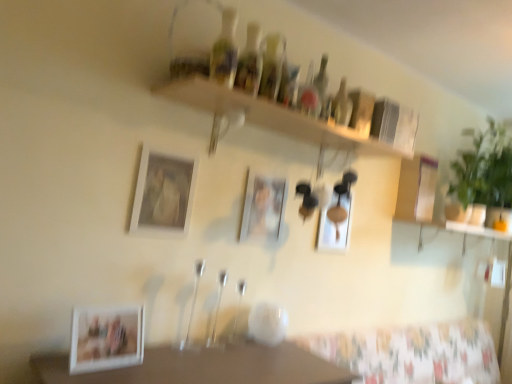
What do you see at coordinates (106, 338) in the screenshot? The width and height of the screenshot is (512, 384). I see `white matte picture frame at lower left, acting as the 4th picture frame starting from the back` at bounding box center [106, 338].

What is the approximate width of matte white picture frame at center, which is counted as the first picture frame, starting from the back?

matte white picture frame at center, which is counted as the first picture frame, starting from the back, is 3.03 centimeters in width.

Describe the element at coordinates (335, 223) in the screenshot. This screenshot has height=384, width=512. I see `matte white picture frame at center, which is counted as the first picture frame, starting from the back` at that location.

I want to click on green leafy plant at right, so click(x=484, y=168).

From a real-world perspective, is matte white picture frame at center, which appears as the 4th picture frame when viewed from the front, positioned above or below translucent glass bottles at upper center, marked as the fourth bottle in a right-to-left arrangement?

In terms of real-world spatial position, matte white picture frame at center, which appears as the 4th picture frame when viewed from the front, is below translucent glass bottles at upper center, marked as the fourth bottle in a right-to-left arrangement.

Is the position of matte white picture frame at center, which appears as the 4th picture frame when viewed from the front, less distant than that of translucent glass bottles at upper center, acting as the fourth bottle starting from the back?

No, it is not.

Considering the sizes of objects matte white picture frame at center, the fourth picture frame viewed from the left, and translucent glass bottles at upper center, marked as the second bottle in a left-to-right arrangement, in the image provided, who is smaller, matte white picture frame at center, the fourth picture frame viewed from the left, or translucent glass bottles at upper center, marked as the second bottle in a left-to-right arrangement,?

translucent glass bottles at upper center, marked as the second bottle in a left-to-right arrangement, is smaller.

Identify the location of the 4th bottle in front of the matte white picture frame at center, which is counted as the first picture frame, starting from the back. (250, 63).

In terms of width, does translucent glass bottles at upper center, arranged as the 1th bottle when viewed from the front, look wider or thinner when compared to matte white picture frame at center, the fourth picture frame viewed from the left?

In the image, translucent glass bottles at upper center, arranged as the 1th bottle when viewed from the front, appears to be wider than matte white picture frame at center, the fourth picture frame viewed from the left.

From the matte white picture frame at center, the first picture frame from the right, count 5th bottles forward and point to it. Please provide its 2D coordinates.

[(225, 51)]

From a real-world perspective, is translucent glass bottles at upper center, which is counted as the fifth bottle, starting from the back, on top of matte white picture frame at center, which appears as the 4th picture frame when viewed from the front?

Yes, from a real-world perspective, translucent glass bottles at upper center, which is counted as the fifth bottle, starting from the back, is on top of matte white picture frame at center, which appears as the 4th picture frame when viewed from the front.

Would you say white matte picture frame at lower left, acting as the 4th picture frame starting from the back, is inside or outside translucent glass bottle at upper center, marked as the 5th bottle in a left-to-right arrangement?

white matte picture frame at lower left, acting as the 4th picture frame starting from the back, is outside translucent glass bottle at upper center, marked as the 5th bottle in a left-to-right arrangement.

Is white matte picture frame at lower left, which appears as the 4th picture frame when viewed from the right, at the right side of translucent glass bottle at upper center, the first bottle from the right?

No.

From a real-world perspective, which bottle is the 1st one above the white matte picture frame at lower left, which is the first picture frame from left to right? Please provide its 2D coordinates.

[(342, 105)]

From a real-world perspective, is white matte picture frame at lower left, acting as the 4th picture frame starting from the back, located beneath translucent glass bottle at upper center, the 5th bottle viewed from the front?

Yes, from a real-world perspective, white matte picture frame at lower left, acting as the 4th picture frame starting from the back, is below translucent glass bottle at upper center, the 5th bottle viewed from the front.

Which is more to the left, matte white picture frame at upper center, the third picture frame positioned from the back, or translucent glass bottle at upper center, positioned as the fourth bottle in front-to-back order?

matte white picture frame at upper center, the third picture frame positioned from the back, is more to the left.

Can you tell me how much matte white picture frame at upper center, marked as the third picture frame in a right-to-left arrangement, and translucent glass bottle at upper center, which appears as the 4th bottle when viewed from the left, differ in facing direction?

matte white picture frame at upper center, marked as the third picture frame in a right-to-left arrangement, and translucent glass bottle at upper center, which appears as the 4th bottle when viewed from the left, are facing 1.01 degrees away from each other.

Looking at this image, is there a large distance between matte white picture frame at upper center, marked as the third picture frame in a right-to-left arrangement, and translucent glass bottle at upper center, the 2th bottle from the back?

That's not correct — matte white picture frame at upper center, marked as the third picture frame in a right-to-left arrangement, is a little close to translucent glass bottle at upper center, the 2th bottle from the back.

From a real-world perspective, which picture frame is the 1st one underneath the translucent glass bottle at upper center, which appears as the 4th bottle when viewed from the left? Please provide its 2D coordinates.

[(163, 193)]

Considering the positions of objects matte silver picture frame at center, the 2th picture frame viewed from the back, and translucent glass bottles at upper center, which is the third bottle from back to front, in the image provided, who is in front, matte silver picture frame at center, the 2th picture frame viewed from the back, or translucent glass bottles at upper center, which is the third bottle from back to front,?

translucent glass bottles at upper center, which is the third bottle from back to front.

Is matte silver picture frame at center, which is the 2th picture frame in right-to-left order, located outside translucent glass bottles at upper center, which is the third bottle from front to back?

That's correct, matte silver picture frame at center, which is the 2th picture frame in right-to-left order, is outside of translucent glass bottles at upper center, which is the third bottle from front to back.

How different are the orientations of matte silver picture frame at center, placed as the 3th picture frame when sorted from left to right, and translucent glass bottles at upper center, which is the third bottle from back to front, in degrees?

0.0385 degrees separate the facing orientations of matte silver picture frame at center, placed as the 3th picture frame when sorted from left to right, and translucent glass bottles at upper center, which is the third bottle from back to front.

Looking at their sizes, would you say matte silver picture frame at center, placed as the 3th picture frame when sorted from left to right, is wider or thinner than translucent glass bottles at upper center, which is the third bottle from front to back?

Considering their sizes, matte silver picture frame at center, placed as the 3th picture frame when sorted from left to right, looks slimmer than translucent glass bottles at upper center, which is the third bottle from front to back.

Is green leafy plant at right surrounded by translucent glass bottle at upper center, the 5th bottle viewed from the front?

No.

Can you tell me how much translucent glass bottle at upper center, the 5th bottle viewed from the front, and green leafy plant at right differ in facing direction?

The angle between the facing direction of translucent glass bottle at upper center, the 5th bottle viewed from the front, and the facing direction of green leafy plant at right is 3.85 degrees.

Is translucent glass bottle at upper center, the 5th bottle viewed from the front, looking in the opposite direction of green leafy plant at right?

No, green leafy plant at right is not at the back of translucent glass bottle at upper center, the 5th bottle viewed from the front.

Measure the distance from white matte picture frame at lower left, which is the first picture frame from left to right, to translucent glass bottles at upper center, which is counted as the fifth bottle, starting from the back.

white matte picture frame at lower left, which is the first picture frame from left to right, is 37.32 inches from translucent glass bottles at upper center, which is counted as the fifth bottle, starting from the back.

Between white matte picture frame at lower left, which appears as the 4th picture frame when viewed from the right, and translucent glass bottles at upper center, which is the fifth bottle in right-to-left order, which one has smaller width?

translucent glass bottles at upper center, which is the fifth bottle in right-to-left order.

Is white matte picture frame at lower left, which appears as the 4th picture frame when viewed from the right, taller or shorter than translucent glass bottles at upper center, the 1th bottle in the left-to-right sequence?

Considering their sizes, white matte picture frame at lower left, which appears as the 4th picture frame when viewed from the right, has less height than translucent glass bottles at upper center, the 1th bottle in the left-to-right sequence.

From the image's perspective, is white matte picture frame at lower left, acting as the 4th picture frame starting from the back, above or below translucent glass bottles at upper center, arranged as the 1th bottle when viewed from the front?

From the image's perspective, white matte picture frame at lower left, acting as the 4th picture frame starting from the back, appears below translucent glass bottles at upper center, arranged as the 1th bottle when viewed from the front.

From the image's perspective, which bottle is the 4th one above the matte white picture frame at center, the first picture frame from the right? Please provide its 2D coordinates.

[(250, 63)]

You are a GUI agent. You are given a task and a screenshot of the screen. Output one action in this format:
    pyautogui.click(x=<x>, y=<y>)
    Task: Click on the 5th bottle in front of the matte white picture frame at center, which is counted as the first picture frame, starting from the back, counting from the anchor's position
    The height and width of the screenshot is (384, 512).
    Given the screenshot: What is the action you would take?
    tap(225, 51)

Looking at the image, which one is located closer to translucent glass bottles at upper center, the 1th bottle in the left-to-right sequence, matte silver picture frame at center, which is the 2th picture frame in right-to-left order, or green leafy plant at right?

Based on the image, matte silver picture frame at center, which is the 2th picture frame in right-to-left order, appears to be nearer to translucent glass bottles at upper center, the 1th bottle in the left-to-right sequence.

Estimate the real-world distances between objects in this image. Which object is further from matte white picture frame at upper center, the third picture frame positioned from the back, translucent glass bottle at upper center, the 2th bottle from the back, or translucent glass bottles at upper center, marked as the fourth bottle in a right-to-left arrangement?

Based on the image, translucent glass bottle at upper center, the 2th bottle from the back, appears to be further to matte white picture frame at upper center, the third picture frame positioned from the back.

Consider the image. From the image, which object appears to be nearer to translucent glass bottle at upper center, marked as the 5th bottle in a left-to-right arrangement, green leafy plant at right or translucent glass bottles at upper center, acting as the fourth bottle starting from the back?

translucent glass bottles at upper center, acting as the fourth bottle starting from the back, lies closer to translucent glass bottle at upper center, marked as the 5th bottle in a left-to-right arrangement, than the other object.

Looking at the image, which one is located further to matte white picture frame at upper center, the third picture frame positioned from the back, translucent glass bottle at upper center, the 5th bottle viewed from the front, or translucent glass bottles at upper center, which is counted as the fifth bottle, starting from the back?

translucent glass bottle at upper center, the 5th bottle viewed from the front, is positioned further to the anchor matte white picture frame at upper center, the third picture frame positioned from the back.

From the image, which object appears to be nearer to translucent glass bottles at upper center, which is the fifth bottle in right-to-left order, translucent glass bottles at upper center, which is the 3th bottle from right to left, or matte white picture frame at center, which appears as the 4th picture frame when viewed from the front?

translucent glass bottles at upper center, which is the 3th bottle from right to left, is closer to translucent glass bottles at upper center, which is the fifth bottle in right-to-left order.

Based on the photo, estimate the real-world distances between objects in this image. Which object is closer to translucent glass bottle at upper center, the first bottle from the right, translucent glass bottles at upper center, which is the third bottle from left to right, or translucent glass bottles at upper center, the 1th bottle in the left-to-right sequence?

Based on the image, translucent glass bottles at upper center, which is the third bottle from left to right, appears to be nearer to translucent glass bottle at upper center, the first bottle from the right.

Based on their spatial positions, is translucent glass bottle at upper center, the 5th bottle viewed from the front, or matte white picture frame at center, which appears as the 4th picture frame when viewed from the front, further from translucent glass bottles at upper center, arranged as the 1th bottle when viewed from the front?

Among the two, matte white picture frame at center, which appears as the 4th picture frame when viewed from the front, is located further to translucent glass bottles at upper center, arranged as the 1th bottle when viewed from the front.

Considering their positions, is translucent glass bottles at upper center, which is the 3th bottle from right to left, positioned closer to matte silver picture frame at center, the 2th picture frame viewed from the back, than matte white picture frame at center, which is counted as the first picture frame, starting from the back?

Based on the image, matte white picture frame at center, which is counted as the first picture frame, starting from the back, appears to be nearer to matte silver picture frame at center, the 2th picture frame viewed from the back.

Locate an element on the screen. The height and width of the screenshot is (384, 512). bottle between translucent glass bottle at upper center, positioned as the fourth bottle in front-to-back order, and matte silver picture frame at center, which is the 2th picture frame in right-to-left order, from top to bottom is located at coordinates (342, 105).

Where is `bottle situated between translucent glass bottles at upper center, which is the 3th bottle from right to left, and translucent glass bottle at upper center, marked as the 5th bottle in a left-to-right arrangement, from left to right`? The height and width of the screenshot is (384, 512). bottle situated between translucent glass bottles at upper center, which is the 3th bottle from right to left, and translucent glass bottle at upper center, marked as the 5th bottle in a left-to-right arrangement, from left to right is located at coordinates (321, 85).

The image size is (512, 384). Find the location of `picture frame between translucent glass bottles at upper center, the 1th bottle in the left-to-right sequence, and matte silver picture frame at center, placed as the 3th picture frame when sorted from left to right, in the vertical direction`. picture frame between translucent glass bottles at upper center, the 1th bottle in the left-to-right sequence, and matte silver picture frame at center, placed as the 3th picture frame when sorted from left to right, in the vertical direction is located at coordinates (163, 193).

In order to click on picture frame located between translucent glass bottle at upper center, the first bottle from the right, and green leafy plant at right in the left-right direction in this screenshot , I will do `click(335, 223)`.